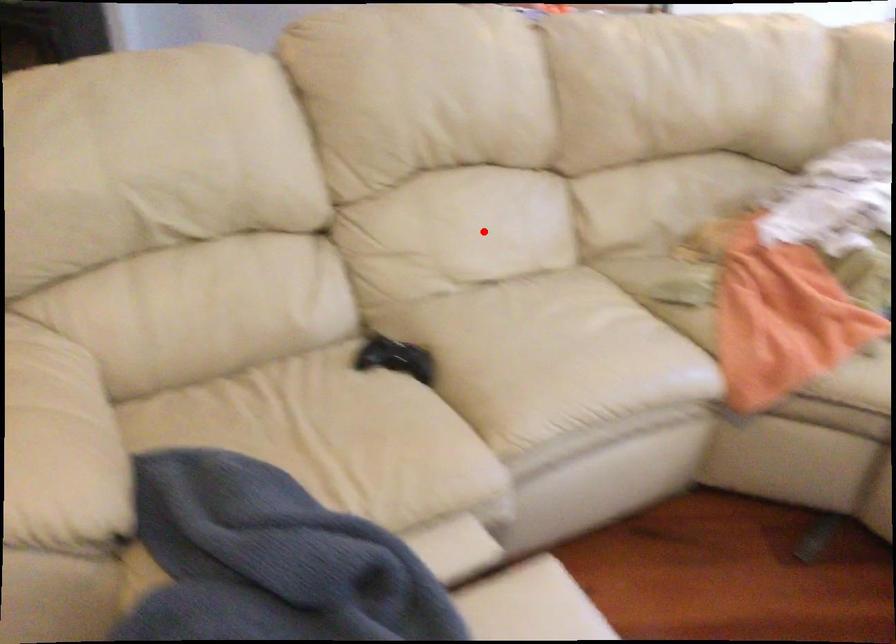
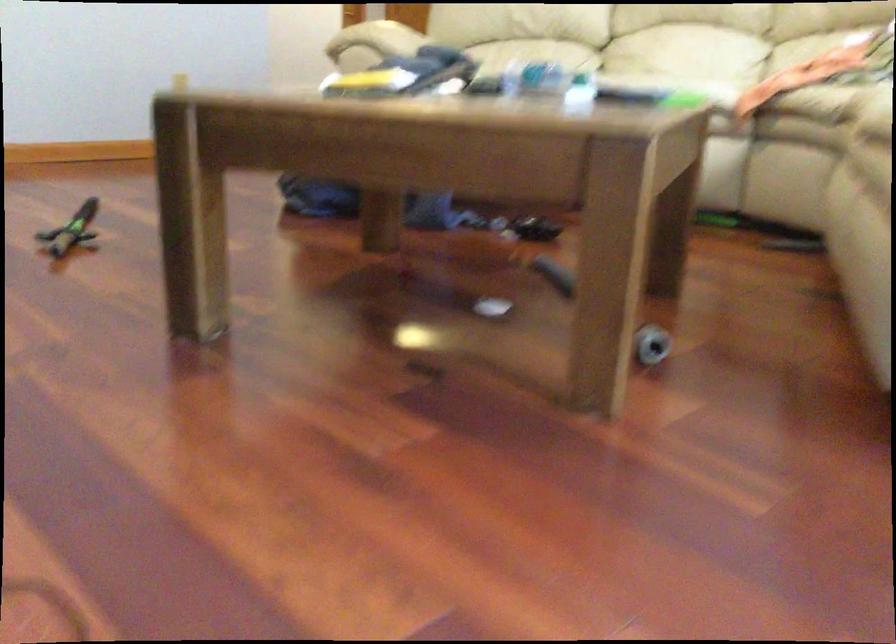
Question: I am providing you with two images of the same scene from different viewpoints. Image1 has a red point marked. In image2, the corresponding 3D location appears at what relative position? Reply with the corresponding letter.

Choices:
 (A) Closer
 (B) Farther

Answer: (B)